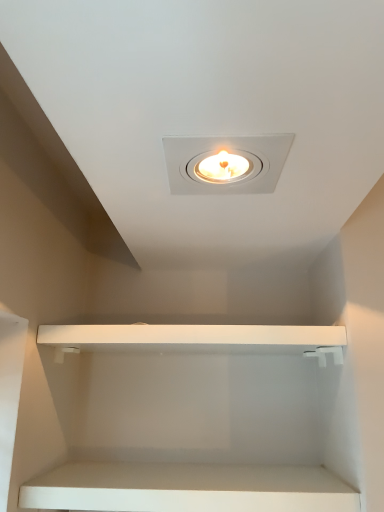
Image resolution: width=384 pixels, height=512 pixels. What do you see at coordinates (188, 488) in the screenshot? I see `white matte cabinet at lower center, which appears as the 2th cabinet when viewed from the top` at bounding box center [188, 488].

Measure the distance between point (152, 501) and camera.

Point (152, 501) is 31.77 inches away from camera.

You are a GUI agent. You are given a task and a screenshot of the screen. Output one action in this format:
    pyautogui.click(x=<x>, y=<y>)
    Task: Click on the white matte cabinet at lower center, which is the 1th cabinet from bottom to top
    
    Given the screenshot: What is the action you would take?
    pyautogui.click(x=188, y=488)

Image resolution: width=384 pixels, height=512 pixels. Describe the element at coordinates (197, 339) in the screenshot. I see `white matte shelf at center, which is the first cabinet from top to bottom` at that location.

What are the coordinates of `white matte shelf at center, which ranks as the 2th cabinet in bottom-to-top order` in the screenshot? It's located at (197, 339).

What is the approximate width of white matte shelf at center, which is the first cabinet from top to bottom?

12.73 inches.

Locate an element on the screen. The width and height of the screenshot is (384, 512). white matte cabinet at lower center, which appears as the 2th cabinet when viewed from the top is located at coordinates (188, 488).

Can you confirm if white matte shelf at center, which is the first cabinet from top to bottom, is positioned to the left of white matte cabinet at lower center, which appears as the 2th cabinet when viewed from the top?

In fact, white matte shelf at center, which is the first cabinet from top to bottom, is to the right of white matte cabinet at lower center, which appears as the 2th cabinet when viewed from the top.

Which object is further away from the camera taking this photo, white matte shelf at center, which is the first cabinet from top to bottom, or white matte cabinet at lower center, which is the 1th cabinet from bottom to top?

white matte shelf at center, which is the first cabinet from top to bottom, is behind.

Which is closer to the camera, [326,346] or [276,475]?

Point [326,346].

From the image's perspective, is white matte shelf at center, which ranks as the 2th cabinet in bottom-to-top order, on white matte cabinet at lower center, which appears as the 2th cabinet when viewed from the top?

Yes, from the image's perspective, white matte shelf at center, which ranks as the 2th cabinet in bottom-to-top order, is on top of white matte cabinet at lower center, which appears as the 2th cabinet when viewed from the top.

From a real-world perspective, is white matte shelf at center, which is the first cabinet from top to bottom, on white matte cabinet at lower center, which is the 1th cabinet from bottom to top?

Yes, from a real-world perspective, white matte shelf at center, which is the first cabinet from top to bottom, is over white matte cabinet at lower center, which is the 1th cabinet from bottom to top

Which object is wider, white matte shelf at center, which ranks as the 2th cabinet in bottom-to-top order, or white matte cabinet at lower center, which appears as the 2th cabinet when viewed from the top?

Wider between the two is white matte shelf at center, which ranks as the 2th cabinet in bottom-to-top order.

Consider the image. Is white matte shelf at center, which is the first cabinet from top to bottom, taller or shorter than white matte cabinet at lower center, which appears as the 2th cabinet when viewed from the top?

Considering their sizes, white matte shelf at center, which is the first cabinet from top to bottom, has more height than white matte cabinet at lower center, which appears as the 2th cabinet when viewed from the top.

Looking at the image, does white matte shelf at center, which ranks as the 2th cabinet in bottom-to-top order, seem bigger or smaller compared to white matte cabinet at lower center, which appears as the 2th cabinet when viewed from the top?

In the image, white matte shelf at center, which ranks as the 2th cabinet in bottom-to-top order, appears to be larger than white matte cabinet at lower center, which appears as the 2th cabinet when viewed from the top.

Does white matte shelf at center, which ranks as the 2th cabinet in bottom-to-top order, contain white matte cabinet at lower center, which is the 1th cabinet from bottom to top?

No, white matte cabinet at lower center, which is the 1th cabinet from bottom to top, is not inside white matte shelf at center, which ranks as the 2th cabinet in bottom-to-top order.

From the picture: Is white matte shelf at center, which ranks as the 2th cabinet in bottom-to-top order, positioned far away from white matte cabinet at lower center, which is the 1th cabinet from bottom to top?

Actually, white matte shelf at center, which ranks as the 2th cabinet in bottom-to-top order, and white matte cabinet at lower center, which is the 1th cabinet from bottom to top, are a little close together.

Is white matte shelf at center, which ranks as the 2th cabinet in bottom-to-top order, positioned with its back to white matte cabinet at lower center, which appears as the 2th cabinet when viewed from the top?

No.

The image size is (384, 512). Find the location of `cabinet on the left of white matte shelf at center, which ranks as the 2th cabinet in bottom-to-top order`. cabinet on the left of white matte shelf at center, which ranks as the 2th cabinet in bottom-to-top order is located at coordinates (188, 488).

Between white matte cabinet at lower center, which appears as the 2th cabinet when viewed from the top, and white matte shelf at center, which ranks as the 2th cabinet in bottom-to-top order, which one appears on the left side from the viewer's perspective?

white matte cabinet at lower center, which appears as the 2th cabinet when viewed from the top.

Relative to white matte shelf at center, which is the first cabinet from top to bottom, is white matte cabinet at lower center, which appears as the 2th cabinet when viewed from the top, in front or behind?

white matte cabinet at lower center, which appears as the 2th cabinet when viewed from the top, is in front of white matte shelf at center, which is the first cabinet from top to bottom.

Considering the points (21, 505) and (153, 333), which point is in front, point (21, 505) or point (153, 333)?

Point (21, 505)

From the image's perspective, relative to white matte shelf at center, which is the first cabinet from top to bottom, is white matte cabinet at lower center, which appears as the 2th cabinet when viewed from the top, above or below?

white matte cabinet at lower center, which appears as the 2th cabinet when viewed from the top, is below white matte shelf at center, which is the first cabinet from top to bottom.

From a real-world perspective, which is physically above, white matte cabinet at lower center, which appears as the 2th cabinet when viewed from the top, or white matte shelf at center, which is the first cabinet from top to bottom?

In real-world perspective, white matte shelf at center, which is the first cabinet from top to bottom, is above.

Considering the sizes of objects white matte cabinet at lower center, which appears as the 2th cabinet when viewed from the top, and white matte shelf at center, which is the first cabinet from top to bottom, in the image provided, who is thinner, white matte cabinet at lower center, which appears as the 2th cabinet when viewed from the top, or white matte shelf at center, which is the first cabinet from top to bottom,?

white matte cabinet at lower center, which appears as the 2th cabinet when viewed from the top.

Considering the relative sizes of white matte cabinet at lower center, which appears as the 2th cabinet when viewed from the top, and white matte shelf at center, which ranks as the 2th cabinet in bottom-to-top order, in the image provided, is white matte cabinet at lower center, which appears as the 2th cabinet when viewed from the top, taller than white matte shelf at center, which ranks as the 2th cabinet in bottom-to-top order,?

In fact, white matte cabinet at lower center, which appears as the 2th cabinet when viewed from the top, may be shorter than white matte shelf at center, which ranks as the 2th cabinet in bottom-to-top order.

Looking at the image, does white matte cabinet at lower center, which appears as the 2th cabinet when viewed from the top, seem bigger or smaller compared to white matte shelf at center, which is the first cabinet from top to bottom?

In the image, white matte cabinet at lower center, which appears as the 2th cabinet when viewed from the top, appears to be smaller than white matte shelf at center, which is the first cabinet from top to bottom.

Based on the photo, would you say white matte cabinet at lower center, which appears as the 2th cabinet when viewed from the top, is outside white matte shelf at center, which is the first cabinet from top to bottom?

Yes.

Is white matte cabinet at lower center, which appears as the 2th cabinet when viewed from the top, touching white matte shelf at center, which is the first cabinet from top to bottom?

No, white matte cabinet at lower center, which appears as the 2th cabinet when viewed from the top, is not with white matte shelf at center, which is the first cabinet from top to bottom.

Is white matte cabinet at lower center, which is the 1th cabinet from bottom to top, turned away from white matte shelf at center, which ranks as the 2th cabinet in bottom-to-top order?

That's not correct — white matte cabinet at lower center, which is the 1th cabinet from bottom to top, is not looking away from white matte shelf at center, which ranks as the 2th cabinet in bottom-to-top order.

How many degrees apart are the facing directions of white matte cabinet at lower center, which appears as the 2th cabinet when viewed from the top, and white matte shelf at center, which ranks as the 2th cabinet in bottom-to-top order?

0.000226 degrees separate the facing orientations of white matte cabinet at lower center, which appears as the 2th cabinet when viewed from the top, and white matte shelf at center, which ranks as the 2th cabinet in bottom-to-top order.

How distant is white matte cabinet at lower center, which appears as the 2th cabinet when viewed from the top, from white matte shelf at center, which ranks as the 2th cabinet in bottom-to-top order?

white matte cabinet at lower center, which appears as the 2th cabinet when viewed from the top, and white matte shelf at center, which ranks as the 2th cabinet in bottom-to-top order, are 11.05 inches apart from each other.

At what (x,y) coordinates should I click in order to perform the action: click on cabinet to the left of white matte shelf at center, which is the first cabinet from top to bottom. Please return your answer as a coordinate pair (x, y). Looking at the image, I should click on (188, 488).

The height and width of the screenshot is (512, 384). What are the coordinates of `cabinet below the white matte shelf at center, which is the first cabinet from top to bottom (from a real-world perspective)` in the screenshot? It's located at (188, 488).

Locate an element on the screen. cabinet located on the right of white matte cabinet at lower center, which is the 1th cabinet from bottom to top is located at coordinates (197, 339).